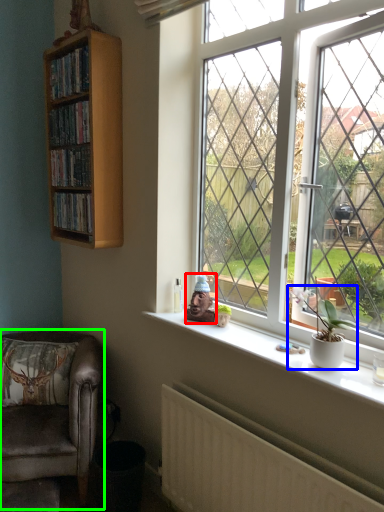
Question: Which object is the closest to the toy (highlighted by a red box)? Choose among these: houseplant (highlighted by a blue box) or chair (highlighted by a green box).

Choices:
 (A) houseplant
 (B) chair

Answer: (A)